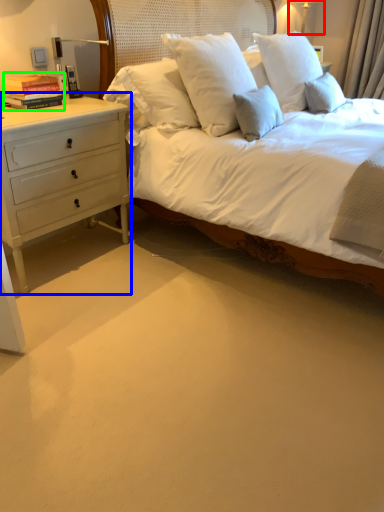
Question: Considering the real-world distances, which object is farthest from bedside lamp (highlighted by a red box)? chest of drawers (highlighted by a blue box) or book (highlighted by a green box)?

Choices:
 (A) chest of drawers
 (B) book

Answer: (A)